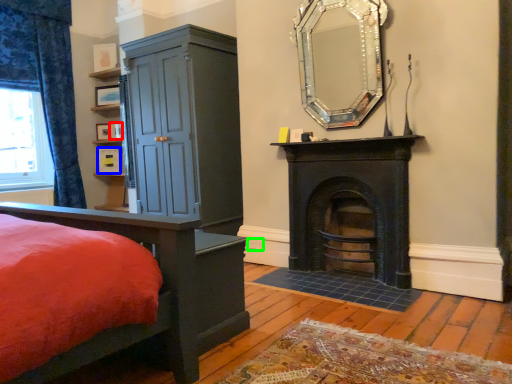
Question: Considering the real-world distances, which object is closest to picture frame (highlighted by a red box)? picture frame (highlighted by a blue box) or power outlet (highlighted by a green box).

Choices:
 (A) picture frame
 (B) power outlet

Answer: (A)